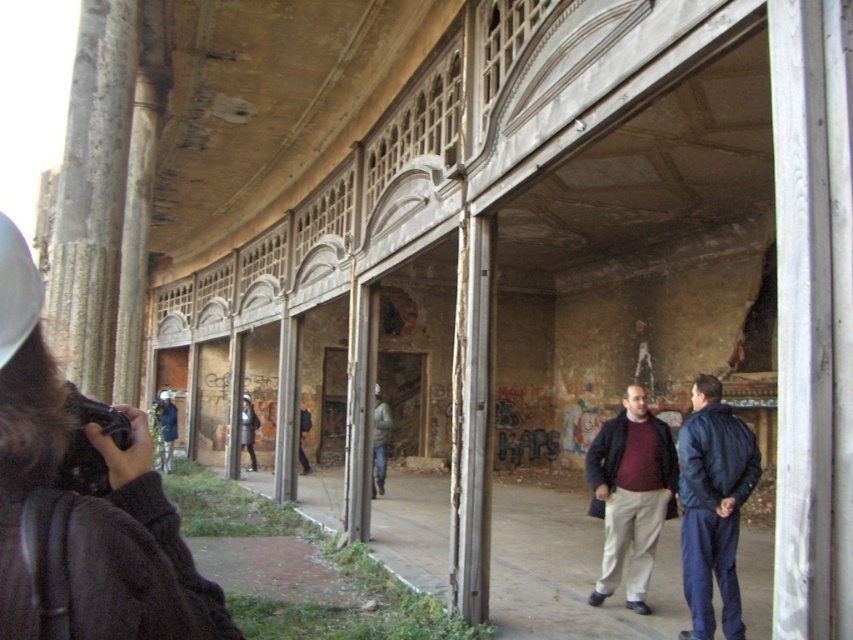
Question: Among these objects, which one is farthest from the camera?

Choices:
 (A) dark blue leather jacket at right
 (B) dark gray jacket at center
 (C) brown knitted sweater at lower left
 (D) matte maroon sweater at center

Answer: (B)

Question: Does matte maroon sweater at center come in front of dark gray jacket at center?

Choices:
 (A) no
 (B) yes

Answer: (B)

Question: Which object is positioned closest to the brown knitted sweater at lower left?

Choices:
 (A) matte maroon sweater at center
 (B) dark gray jacket at center

Answer: (A)

Question: Is brown knitted sweater at lower left positioned behind dark blue leather jacket at right?

Choices:
 (A) yes
 (B) no

Answer: (B)

Question: Can you confirm if dark blue leather jacket at right is positioned to the right of dark gray jacket at center?

Choices:
 (A) yes
 (B) no

Answer: (A)

Question: Which object appears farthest from the camera in this image?

Choices:
 (A) brown knitted sweater at lower left
 (B) dark blue leather jacket at right
 (C) matte maroon sweater at center

Answer: (C)